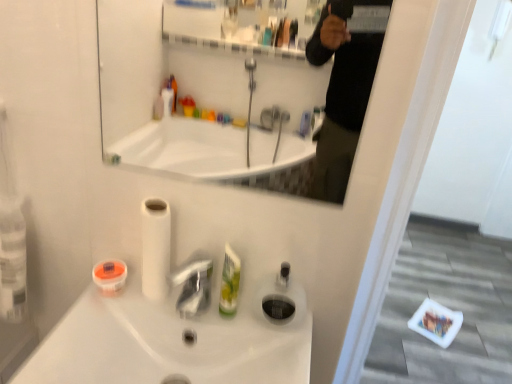
Question: From a real-world perspective, is white glossy mirror at upper center positioned above or below transparent plastic soap dispenser at center?

Choices:
 (A) above
 (B) below

Answer: (A)

Question: Based on their positions, is white glossy mirror at upper center located to the left or right of transparent plastic soap dispenser at center?

Choices:
 (A) right
 (B) left

Answer: (B)

Question: Which object is the closest to the white glossy sink at center?

Choices:
 (A) transparent plastic soap dispenser at center
 (B) orange matte container at lower left, the 1th mouthwash in the left-to-right sequence
 (C) white glossy mirror at upper center
 (D) green plastic mouthwash at center, the 1th mouthwash in the right-to-left sequence
 (E) white matte toilet paper at center

Answer: (E)

Question: Estimate the real-world distances between objects in this image. Which object is closer to the green plastic mouthwash at center, the 1th mouthwash in the right-to-left sequence?

Choices:
 (A) white glossy mirror at upper center
 (B) transparent plastic soap dispenser at center
 (C) white matte toilet paper at center
 (D) orange matte container at lower left, the 2th mouthwash when ordered from right to left
 (E) white glossy sink at center

Answer: (B)